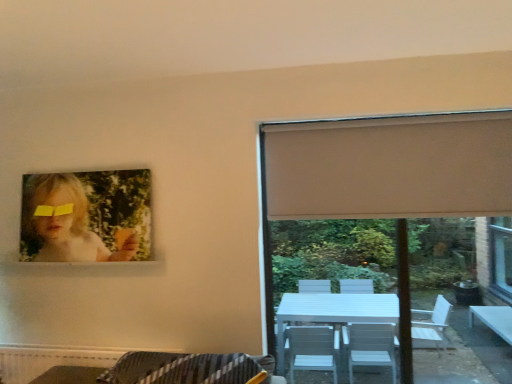
Question: Could yellow matte glasses at upper left be considered to be inside beige fabric curtain at right?

Choices:
 (A) yes
 (B) no

Answer: (B)

Question: Is beige fabric curtain at right further to the viewer compared to yellow matte glasses at upper left?

Choices:
 (A) no
 (B) yes

Answer: (A)

Question: Is beige fabric curtain at right in contact with yellow matte glasses at upper left?

Choices:
 (A) yes
 (B) no

Answer: (B)

Question: Considering the relative sizes of beige fabric curtain at right and yellow matte glasses at upper left in the image provided, is beige fabric curtain at right wider than yellow matte glasses at upper left?

Choices:
 (A) no
 (B) yes

Answer: (B)

Question: From the image's perspective, is beige fabric curtain at right over yellow matte glasses at upper left?

Choices:
 (A) yes
 (B) no

Answer: (A)

Question: In terms of width, does matte paper portrait at upper left look wider or thinner when compared to yellow matte glasses at upper left?

Choices:
 (A) wide
 (B) thin

Answer: (A)

Question: From the image's perspective, is matte paper portrait at upper left positioned above or below yellow matte glasses at upper left?

Choices:
 (A) above
 (B) below

Answer: (B)

Question: Is matte paper portrait at upper left in front of or behind yellow matte glasses at upper left in the image?

Choices:
 (A) behind
 (B) front

Answer: (B)

Question: Is point (113, 233) positioned closer to the camera than point (67, 206)?

Choices:
 (A) closer
 (B) farther

Answer: (A)

Question: Considering the relative positions of white matte window at upper right and yellow matte glasses at upper left in the image provided, is white matte window at upper right to the left or to the right of yellow matte glasses at upper left?

Choices:
 (A) left
 (B) right

Answer: (B)

Question: From a real-world perspective, is white matte window at upper right physically located above or below yellow matte glasses at upper left?

Choices:
 (A) above
 (B) below

Answer: (B)

Question: Is point tap(398, 258) positioned closer to the camera than point tap(44, 205)?

Choices:
 (A) farther
 (B) closer

Answer: (A)

Question: From the image's perspective, is white matte window at upper right above or below yellow matte glasses at upper left?

Choices:
 (A) below
 (B) above

Answer: (A)

Question: Which is correct: matte paper portrait at upper left is inside white matte window at upper right, or outside of it?

Choices:
 (A) inside
 (B) outside

Answer: (B)

Question: Is matte paper portrait at upper left taller or shorter than white matte window at upper right?

Choices:
 (A) tall
 (B) short

Answer: (B)